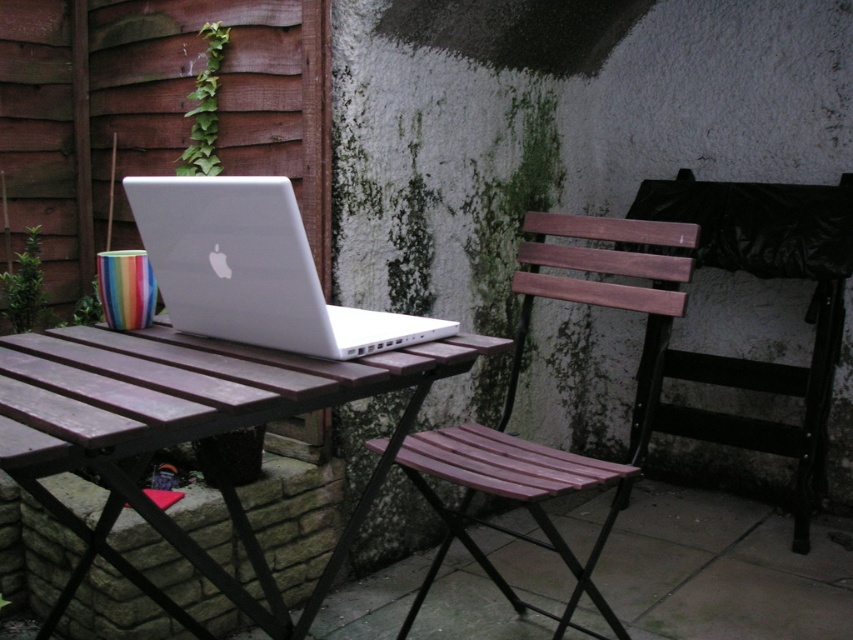
Is wooden table at center to the left of pink wood stool at center from the viewer's perspective?

Indeed, wooden table at center is positioned on the left side of pink wood stool at center.

Which is in front, point (198, 632) or point (465, 483)?

Positioned in front is point (198, 632).

Who is more forward, (6, 426) or (604, 468)?

Point (6, 426) is in front.

Locate an element on the screen. This screenshot has width=853, height=640. wooden table at center is located at coordinates (186, 433).

Does wooden slats chair at center appear under pink wood stool at center?

No.

How much distance is there between wooden slats chair at center and pink wood stool at center?

wooden slats chair at center and pink wood stool at center are 3.28 inches apart.

Between point (589, 582) and point (556, 470), which one is positioned behind?

The point (556, 470) is more distant.

Where is `wooden slats chair at center`? wooden slats chair at center is located at coordinates (514, 394).

Who is positioned more to the left, sleek silver laptop at center or pink wood stool at center?

Positioned to the left is sleek silver laptop at center.

Is the position of sleek silver laptop at center less distant than that of pink wood stool at center?

Yes.

Find the location of a particular element. sleek silver laptop at center is located at coordinates (253, 269).

Where is `sleek silver laptop at center`? sleek silver laptop at center is located at coordinates (253, 269).